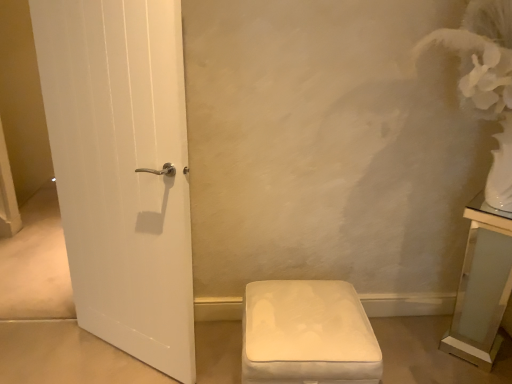
Question: Is the depth of clear glass vanity at right less than that of white fabric ottoman at lower center?

Choices:
 (A) yes
 (B) no

Answer: (B)

Question: Considering the relative sizes of clear glass vanity at right and white fabric ottoman at lower center in the image provided, is clear glass vanity at right taller than white fabric ottoman at lower center?

Choices:
 (A) yes
 (B) no

Answer: (A)

Question: Is clear glass vanity at right not near white fabric ottoman at lower center?

Choices:
 (A) no
 (B) yes

Answer: (A)

Question: Is clear glass vanity at right thinner than white fabric ottoman at lower center?

Choices:
 (A) yes
 (B) no

Answer: (A)

Question: Does clear glass vanity at right come behind white fabric ottoman at lower center?

Choices:
 (A) yes
 (B) no

Answer: (A)

Question: Is clear glass vanity at right bigger than white fabric ottoman at lower center?

Choices:
 (A) yes
 (B) no

Answer: (B)

Question: Would you consider white fabric ottoman at lower center to be distant from clear glass vanity at right?

Choices:
 (A) no
 (B) yes

Answer: (A)

Question: Is white fabric ottoman at lower center aimed at clear glass vanity at right?

Choices:
 (A) yes
 (B) no

Answer: (B)

Question: Does white fabric ottoman at lower center appear on the right side of clear glass vanity at right?

Choices:
 (A) no
 (B) yes

Answer: (A)

Question: Is white fabric ottoman at lower center at the left side of clear glass vanity at right?

Choices:
 (A) yes
 (B) no

Answer: (A)

Question: Is white fabric ottoman at lower center smaller than clear glass vanity at right?

Choices:
 (A) no
 (B) yes

Answer: (A)

Question: Can you confirm if white fabric ottoman at lower center is wider than clear glass vanity at right?

Choices:
 (A) yes
 (B) no

Answer: (A)

Question: From a real-world perspective, is clear glass vanity at right above or below white fabric ottoman at lower center?

Choices:
 (A) above
 (B) below

Answer: (A)